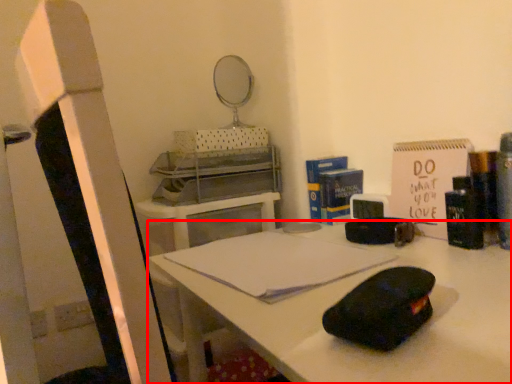
Question: From the image, what is the correct spatial relationship of desk (annotated by the red box) in relation to notebook?

Choices:
 (A) left
 (B) right

Answer: (B)